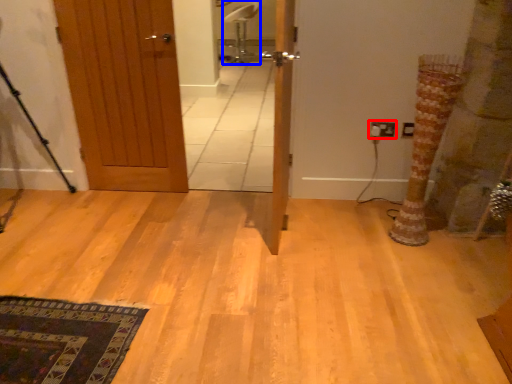
Question: Which of the following is the closest to the observer, electric outlet (highlighted by a red box) or chair (highlighted by a blue box)?

Choices:
 (A) electric outlet
 (B) chair

Answer: (A)